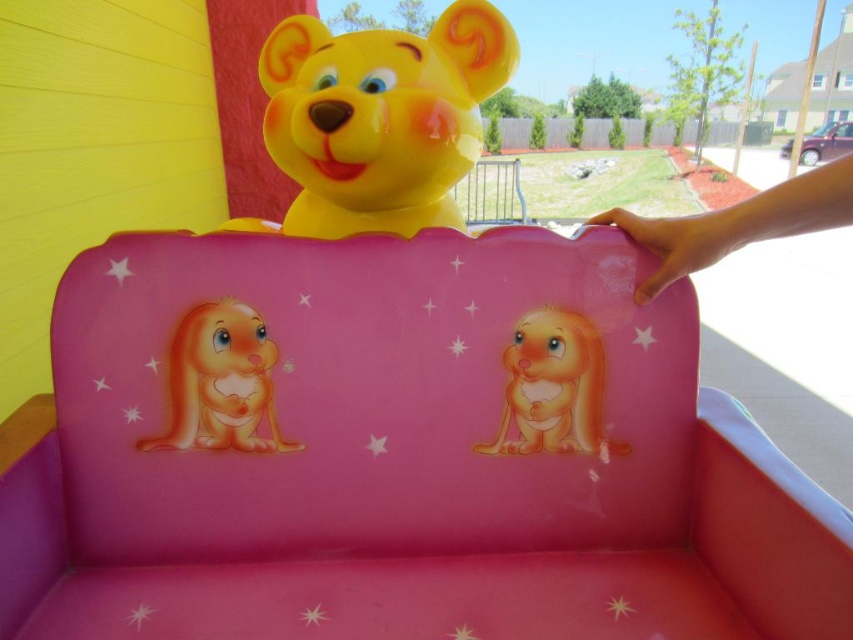
Looking at the children ride, where is the matte yellow plastic teddy bear at upper center in relation to the matte orange plush rabbit at center?

The matte yellow plastic teddy bear at upper center is to the left of the matte orange plush rabbit at center.

You are a child trying to reach the matte yellow plastic teddy bear at upper center and the matte orange plush rabbit at center to touch them both. Which one will you need to stretch your arms higher to reach?

The matte yellow plastic teddy bear at upper center has a greater height compared to the matte orange plush rabbit at center, so you will need to stretch your arms higher to reach the matte yellow plastic teddy bear at upper center.

You are a parent trying to ensure your child can safely reach both the pink plastic chair at center and the glossy plastic bunny at left. If your child can stretch their arms 6 inches, will they be able to touch both objects at the same time?

The pink plastic chair at center is 7.42 inches from the glossy plastic bunny at left. Since your child can only stretch their arms 6 inches, they cannot reach both objects simultaneously.